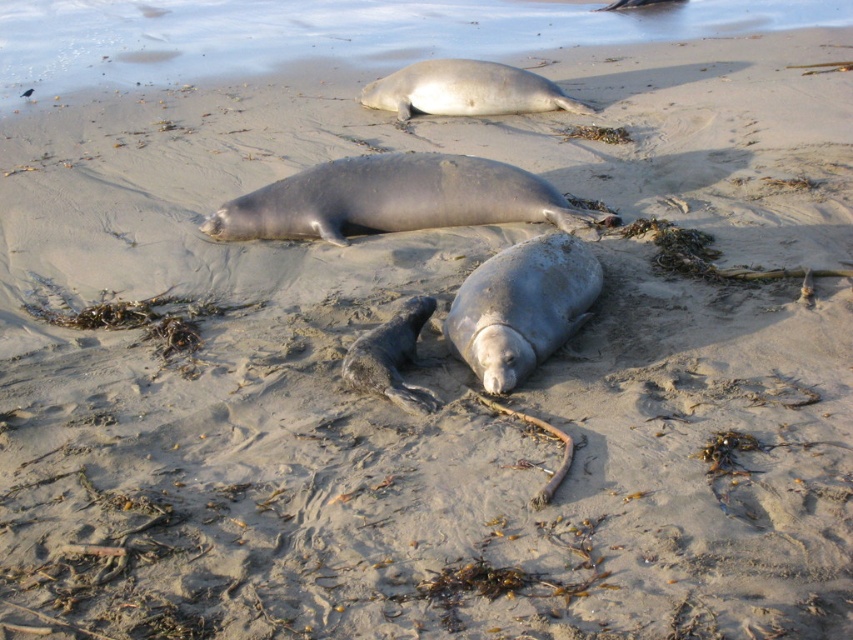
You are a wildlife photographer aiming to capture the seals in this beach scene. You want to ensure that your camera frame includes both the gray matte seal at center and the gray matte seal at upper center. Given their sizes, which seal should you focus on to ensure both fit comfortably within the frame?

The gray matte seal at center is thinner than the gray matte seal at upper center, so focusing on the larger gray matte seal at upper center will allow both seals to fit comfortably within the frame.

You are standing on the beach and want to approach the smooth gray seal at center without disturbing it. Given that the seal is sensitive to movements from the left side, which direction should you approach from based on its position?

The smooth gray seal at center is located at point (x=397, y=198). Since it is sensitive to movements from the left side, you should approach from the right side to avoid disturbing it.

You are standing on the beach looking at the seals. There are two points marked on the sand where you want to place your camera tripod. The first point is at coordinates point (521,253) and the second is at point (466,74). Which point is closer to you where you can set up your tripod?

The point at coordinates point (521,253) is closer to you than point (466,74), so you should set up your tripod there.